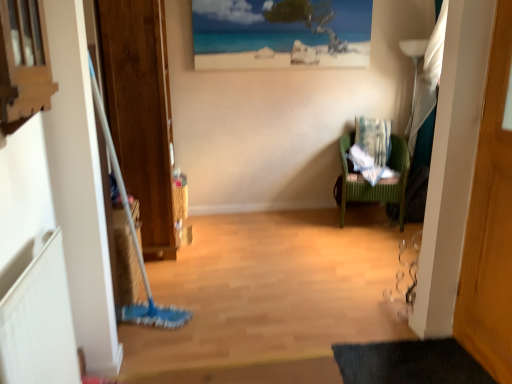
Question: Should I look upward or downward to see patterned fabric laundry at right?

Choices:
 (A) up
 (B) down

Answer: (A)

Question: Does black rubber bath mat at lower right lie behind beach scene print at upper center?

Choices:
 (A) yes
 (B) no

Answer: (B)

Question: Would you consider black rubber bath mat at lower right to be distant from beach scene print at upper center?

Choices:
 (A) no
 (B) yes

Answer: (B)

Question: Does black rubber bath mat at lower right lie in front of beach scene print at upper center?

Choices:
 (A) yes
 (B) no

Answer: (A)

Question: Is black rubber bath mat at lower right taller than beach scene print at upper center?

Choices:
 (A) no
 (B) yes

Answer: (A)

Question: Can beach scene print at upper center be found inside black rubber bath mat at lower right?

Choices:
 (A) yes
 (B) no

Answer: (B)

Question: Considering the relative sizes of black rubber bath mat at lower right and beach scene print at upper center in the image provided, is black rubber bath mat at lower right thinner than beach scene print at upper center?

Choices:
 (A) yes
 (B) no

Answer: (B)

Question: Is beach scene print at upper center behind bamboo picnic basket at center?

Choices:
 (A) yes
 (B) no

Answer: (A)

Question: From a real-world perspective, is beach scene print at upper center beneath bamboo picnic basket at center?

Choices:
 (A) no
 (B) yes

Answer: (A)

Question: Would you say beach scene print at upper center is a long distance from bamboo picnic basket at center?

Choices:
 (A) yes
 (B) no

Answer: (A)

Question: Can you confirm if beach scene print at upper center is shorter than bamboo picnic basket at center?

Choices:
 (A) yes
 (B) no

Answer: (B)

Question: From the image's perspective, does beach scene print at upper center appear higher than bamboo picnic basket at center?

Choices:
 (A) no
 (B) yes

Answer: (B)

Question: From a real-world perspective, is beach scene print at upper center over bamboo picnic basket at center?

Choices:
 (A) yes
 (B) no

Answer: (A)

Question: Are patterned fabric laundry at right and wooden door at right far apart?

Choices:
 (A) no
 (B) yes

Answer: (B)